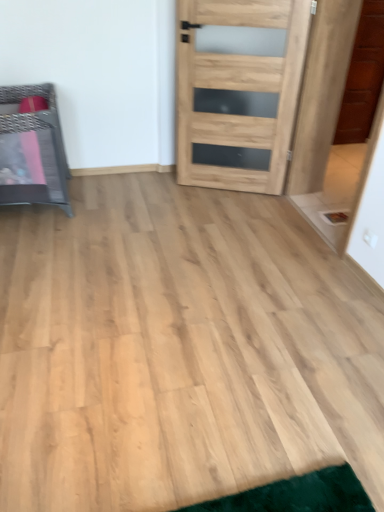
Image resolution: width=384 pixels, height=512 pixels. In order to click on free space on the front side of natural wood door at center in this screenshot , I will do `click(236, 215)`.